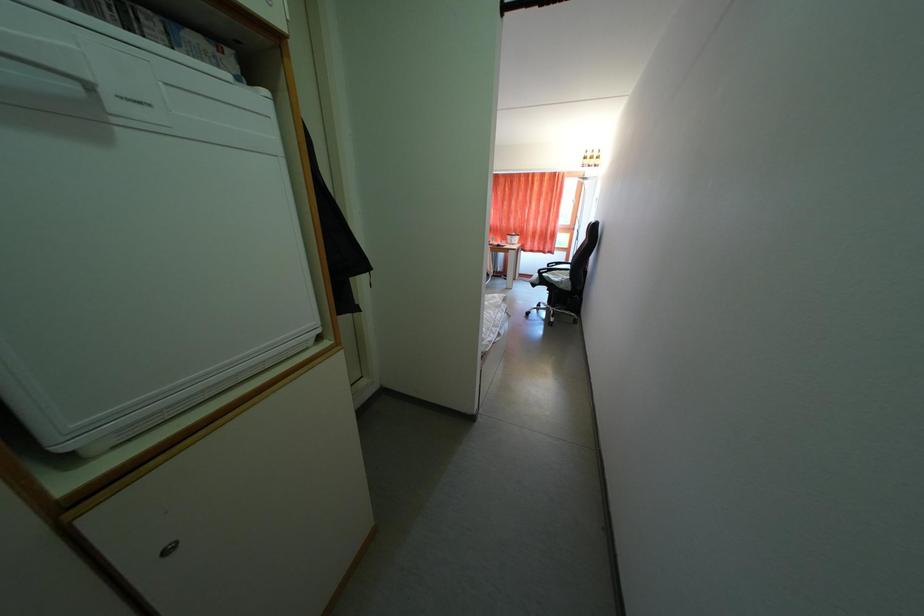
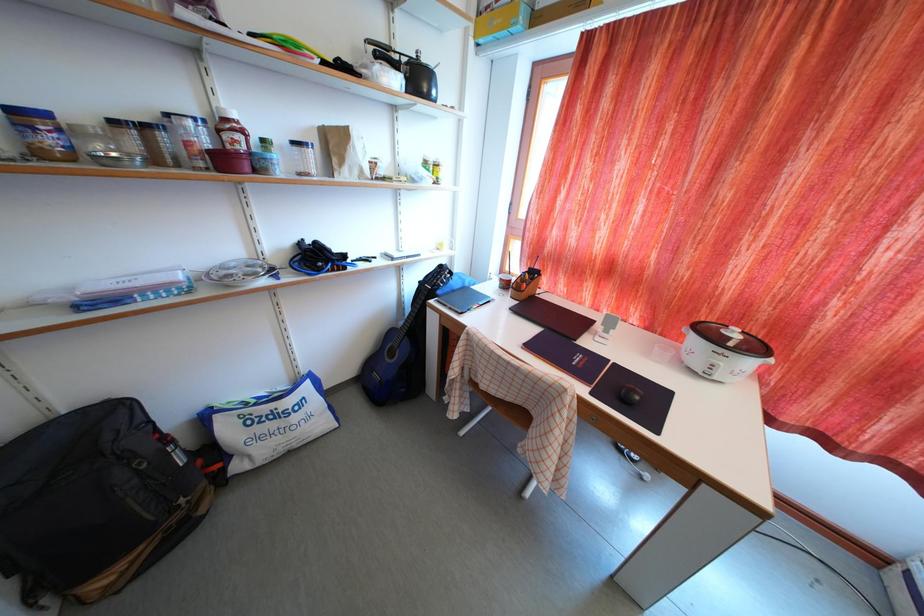
Question: In a continuous first-person perspective shot, in which direction is the camera moving?

Choices:
 (A) Left
 (B) Right
 (C) Forward
 (D) Backward

Answer: (C)